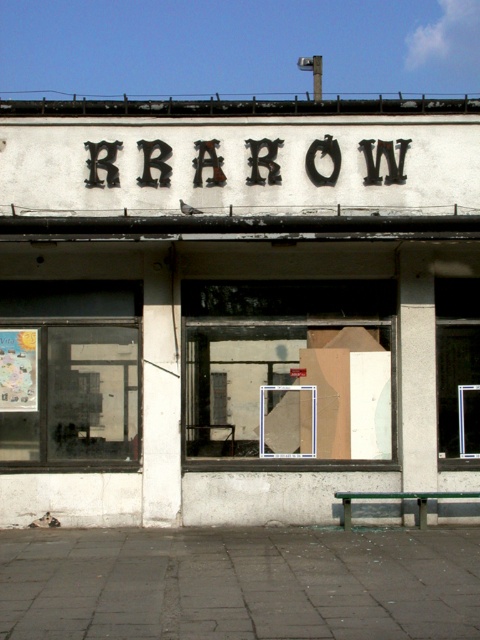
Is white concrete storefront at center taller than wooden bulletin board at center?

In fact, white concrete storefront at center may be shorter than wooden bulletin board at center.

Between point (400, 513) and point (23, 333), which one is positioned in front?

Positioned in front is point (400, 513).

This screenshot has width=480, height=640. In order to click on white concrete storefront at center in this screenshot , I will do `click(229, 301)`.

Is transparent glass window at right above wooden bulletin board at center?

Yes, transparent glass window at right is above wooden bulletin board at center.

Between point (455, 413) and point (26, 384), which one is positioned in front?

Point (26, 384) is more forward.

Who is more forward, (437, 417) or (24, 355)?

Point (437, 417)

What are the coordinates of `transparent glass window at right` in the screenshot? It's located at (457, 365).

Is white concrete storefront at center to the right of black metal sign at center from the viewer's perspective?

Correct, you'll find white concrete storefront at center to the right of black metal sign at center.

Who is higher up, white concrete storefront at center or black metal sign at center?

Positioned higher is white concrete storefront at center.

Is point (336, 440) positioned behind point (388, 164)?

No.

At what (x,y) coordinates should I click in order to perform the action: click on white concrete storefront at center. Please return your answer as a coordinate pair (x, y). The image size is (480, 640). Looking at the image, I should click on (229, 301).